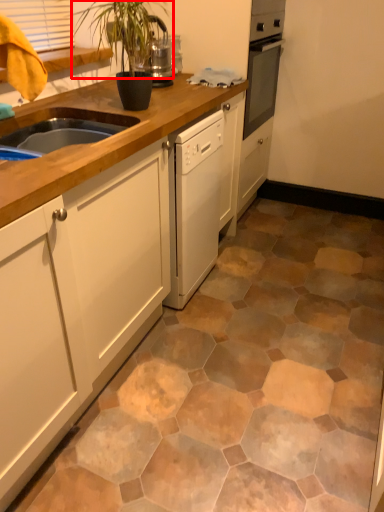
Question: From the image's perspective, considering the relative positions of plant (annotated by the red box) and cabinetry in the image provided, where is plant (annotated by the red box) located with respect to the staircase?

Choices:
 (A) above
 (B) below

Answer: (A)